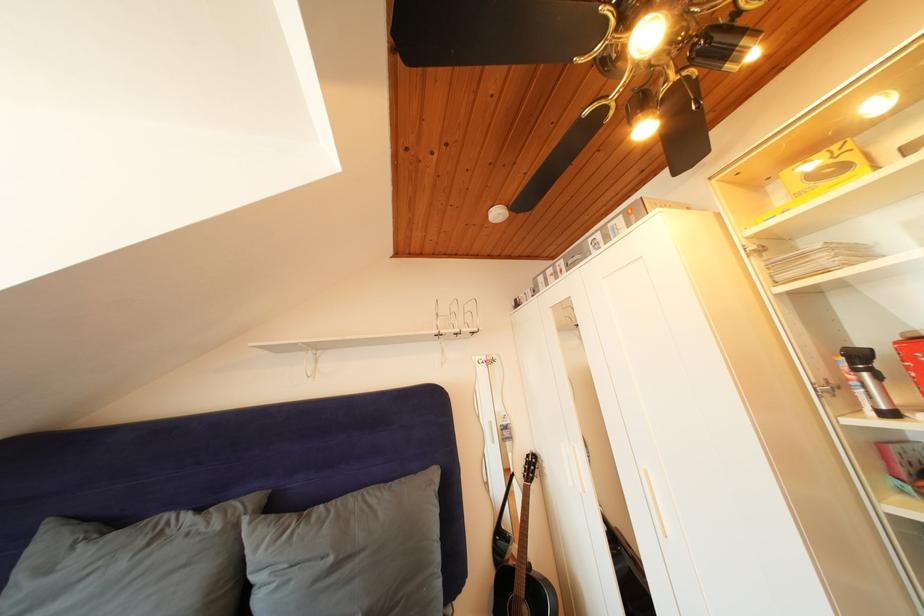
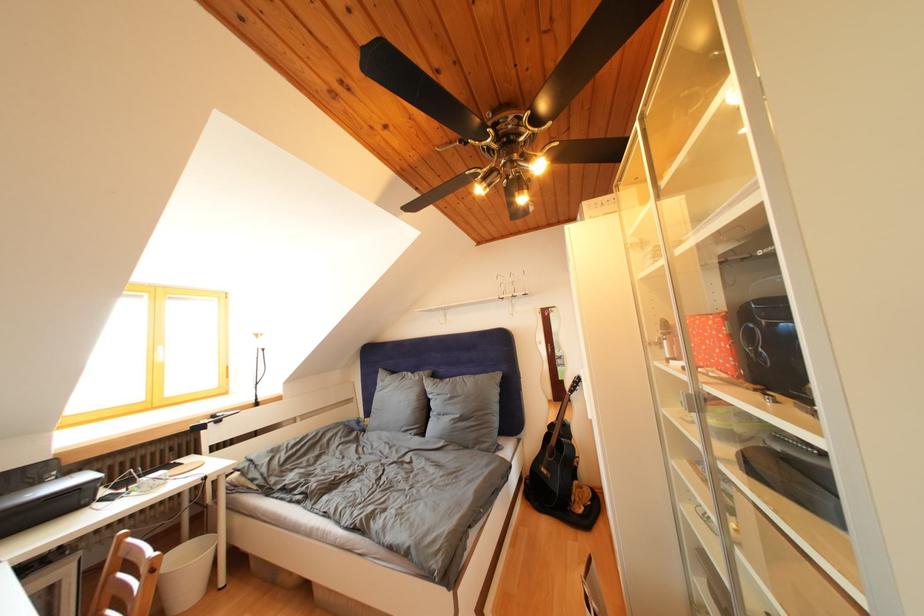
Where in the second image is the point corresponding to the point at 122,528 from the first image?

(400, 378)